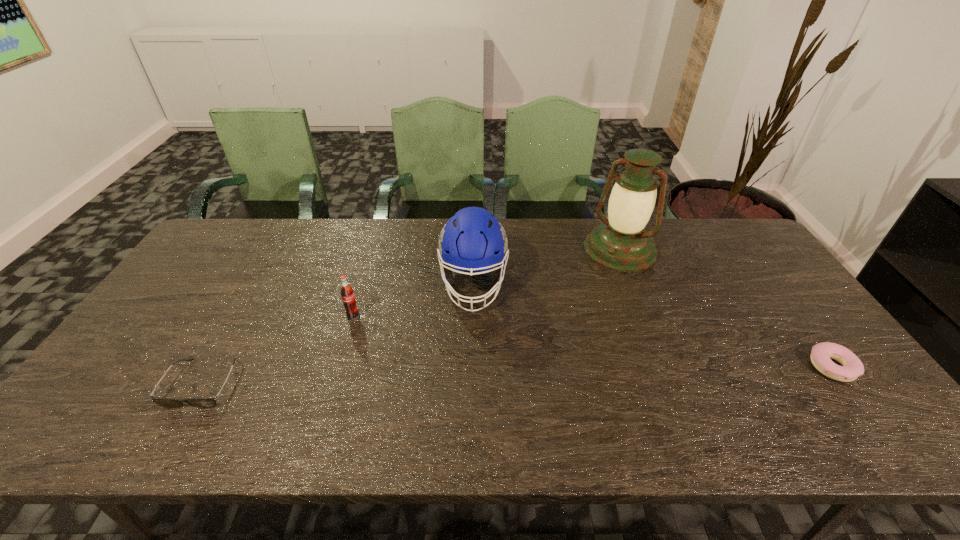
Select which object is the closest to the second tallest object. Please provide its 2D coordinates. Your answer should be formatted as a tuple, i.e. [(x, y)], where the tuple contains the x and y coordinates of a point satisfying the conditions above.

[(348, 298)]

Where is `object that is the fourth closest to the soda bottle`? object that is the fourth closest to the soda bottle is located at coordinates (822, 353).

The width and height of the screenshot is (960, 540). In order to click on vacant region that satisfies the following two spatial constraints: 1. on the back side of the lantern; 2. on the left side of the third tallest object in this screenshot , I will do `click(373, 249)`.

The width and height of the screenshot is (960, 540). Identify the location of vacant point that satisfies the following two spatial constraints: 1. on the back side of the tallest object; 2. on the left side of the football helmet. (474, 249).

Where is `free space that satisfies the following two spatial constraints: 1. on the back side of the third shortest object; 2. on the right side of the tallest object`? The width and height of the screenshot is (960, 540). free space that satisfies the following two spatial constraints: 1. on the back side of the third shortest object; 2. on the right side of the tallest object is located at coordinates (373, 249).